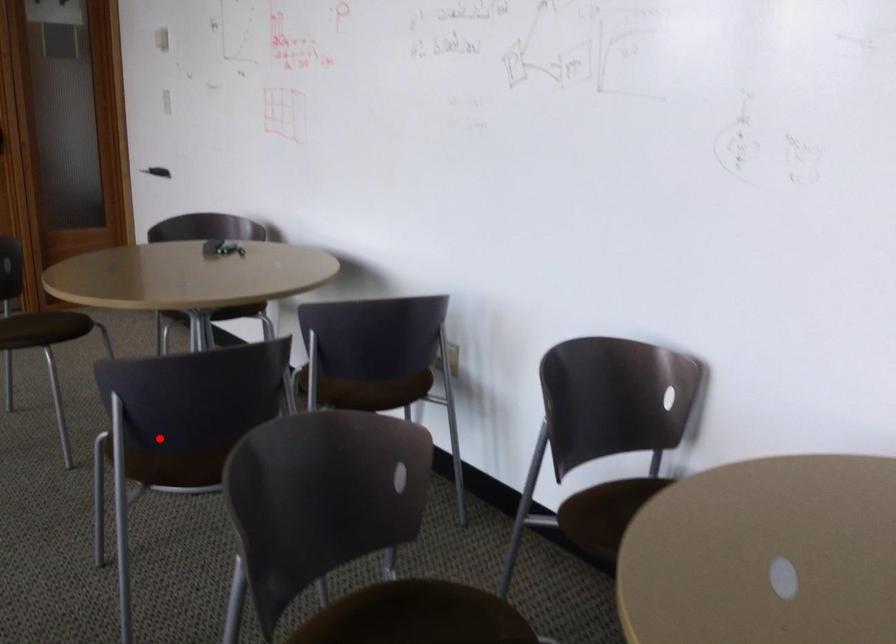
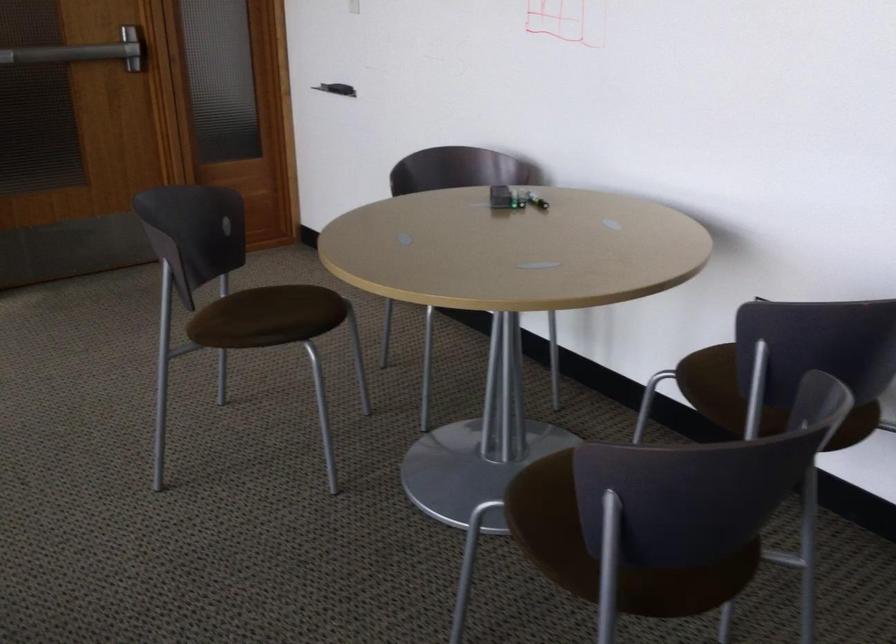
Where in the second image is the point corresponding to the highlighted location from the first image?

(554, 524)